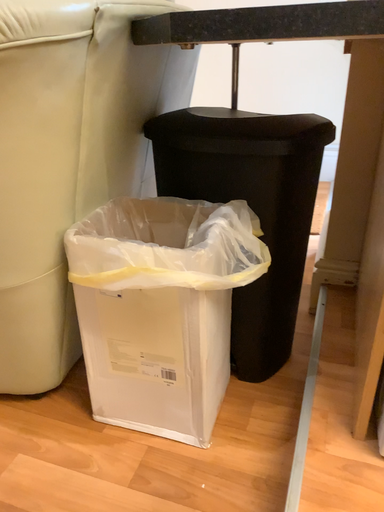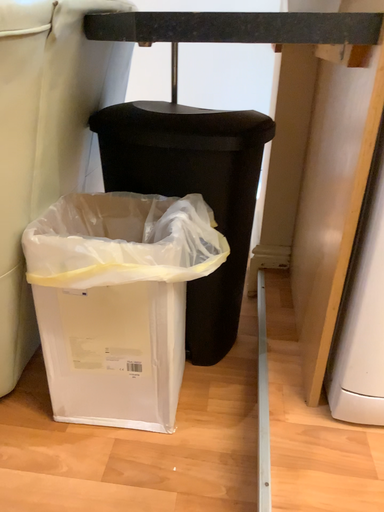
Question: How did the camera likely rotate when shooting the video?

Choices:
 (A) rotated left
 (B) rotated right

Answer: (B)